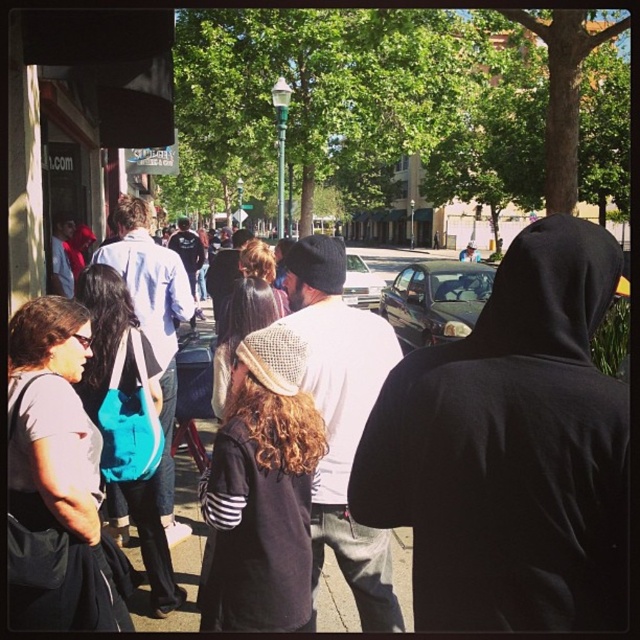
Question: Is dark brown knit cap at center positioned in front of shiny black sedan at center?

Choices:
 (A) no
 (B) yes

Answer: (B)

Question: Is dark brown knit cap at center closer to the viewer compared to silver metallic sedan at center?

Choices:
 (A) no
 (B) yes

Answer: (B)

Question: Which object is farther from the camera taking this photo?

Choices:
 (A) shiny black sedan at center
 (B) dark brown knit cap at center
 (C) silver metallic sedan at center

Answer: (A)

Question: Does dark brown knit cap at center appear over shiny black sedan at center?

Choices:
 (A) yes
 (B) no

Answer: (B)

Question: Among these points, which one is farthest from the camera?

Choices:
 (A) (300, 474)
 (B) (355, 294)

Answer: (B)

Question: Which point is farther from the camera taking this photo?

Choices:
 (A) pyautogui.click(x=413, y=304)
 (B) pyautogui.click(x=346, y=278)
 (C) pyautogui.click(x=280, y=456)

Answer: (A)